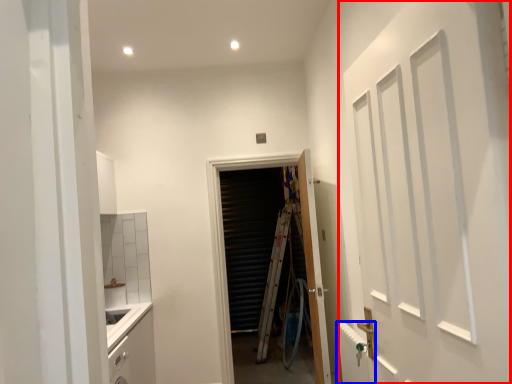
Question: Which object appears farthest to the camera in this image, door (highlighted by a red box) or radiator (highlighted by a blue box)?

Choices:
 (A) door
 (B) radiator

Answer: (B)